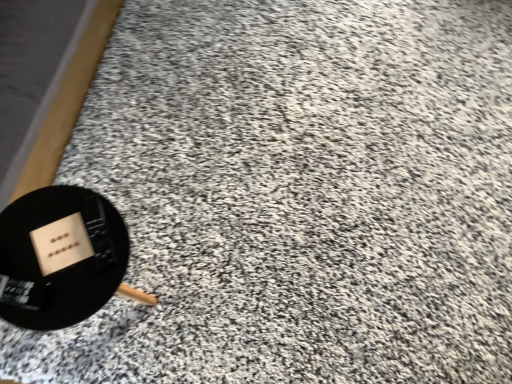
This screenshot has height=384, width=512. I want to click on black matte pad at lower left, so click(60, 257).

What do you see at coordinates (60, 257) in the screenshot? The height and width of the screenshot is (384, 512). I see `black matte pad at lower left` at bounding box center [60, 257].

Find the location of a particular element. The image size is (512, 384). black matte pad at lower left is located at coordinates (60, 257).